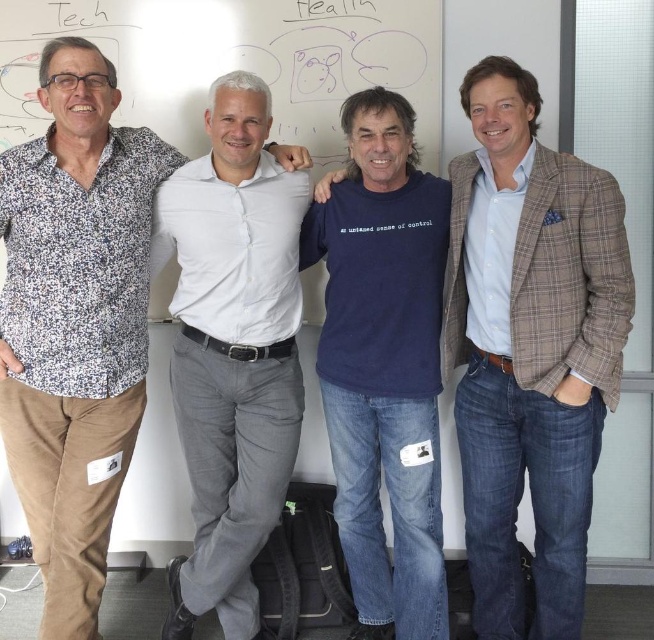
Consider the image. Between blue cotton t-shirt at center and white smooth shirt at center, which one appears on the right side from the viewer's perspective?

From the viewer's perspective, blue cotton t-shirt at center appears more on the right side.

Who is more distant from viewer, (x=502, y=83) or (x=201, y=394)?

Positioned behind is point (x=201, y=394).

This screenshot has width=654, height=640. What are the coordinates of `blue cotton t-shirt at center` in the screenshot? It's located at click(530, 348).

Is white smooth shirt at center positioned before dark blue cotton t-shirt at center?

That is True.

Is white smooth shirt at center thinner than dark blue cotton t-shirt at center?

No, white smooth shirt at center is not thinner than dark blue cotton t-shirt at center.

This screenshot has height=640, width=654. What do you see at coordinates (232, 348) in the screenshot?
I see `white smooth shirt at center` at bounding box center [232, 348].

This screenshot has height=640, width=654. I want to click on white smooth shirt at center, so click(x=232, y=348).

Does floral print shirt at left appear on the right side of white smooth shirt at center?

In fact, floral print shirt at left is to the left of white smooth shirt at center.

Which is more to the left, floral print shirt at left or white smooth shirt at center?

From the viewer's perspective, floral print shirt at left appears more on the left side.

Image resolution: width=654 pixels, height=640 pixels. What do you see at coordinates (75, 321) in the screenshot?
I see `floral print shirt at left` at bounding box center [75, 321].

Locate an element on the screen. The image size is (654, 640). floral print shirt at left is located at coordinates (75, 321).